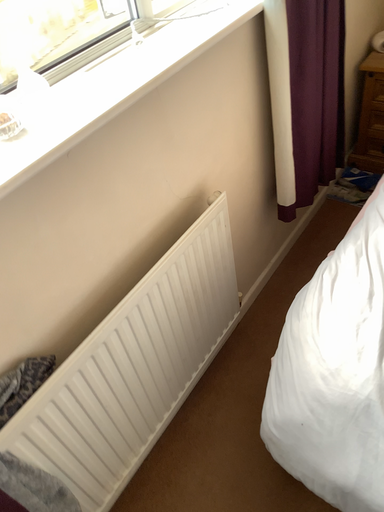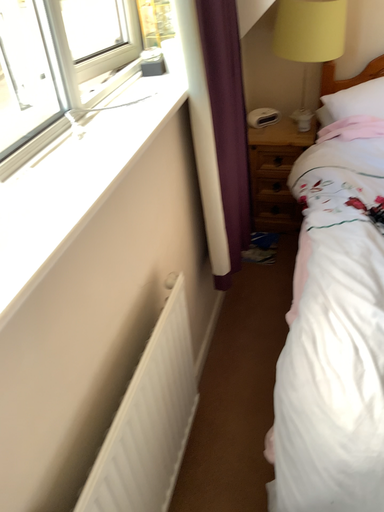
Question: How did the camera likely rotate when shooting the video?

Choices:
 (A) rotated right
 (B) rotated left

Answer: (A)